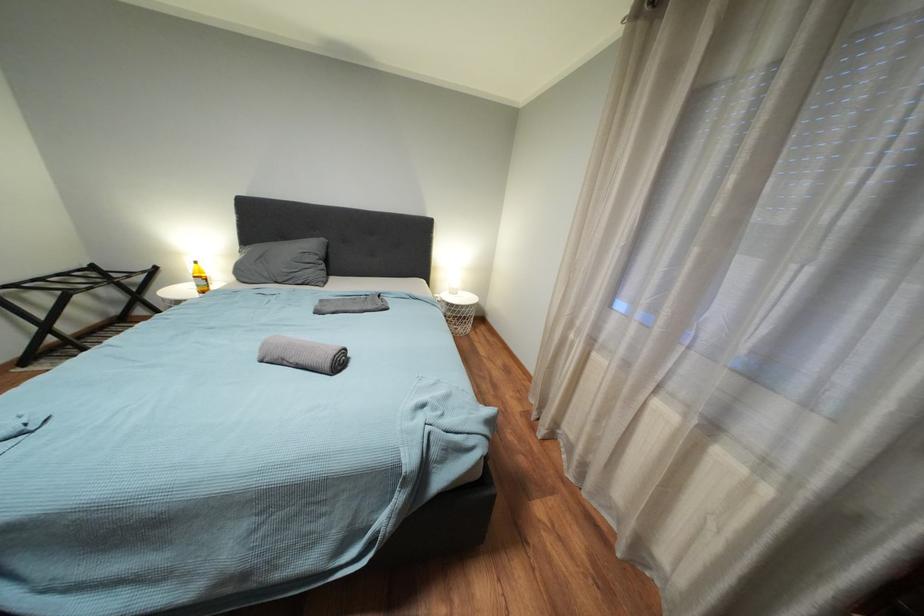
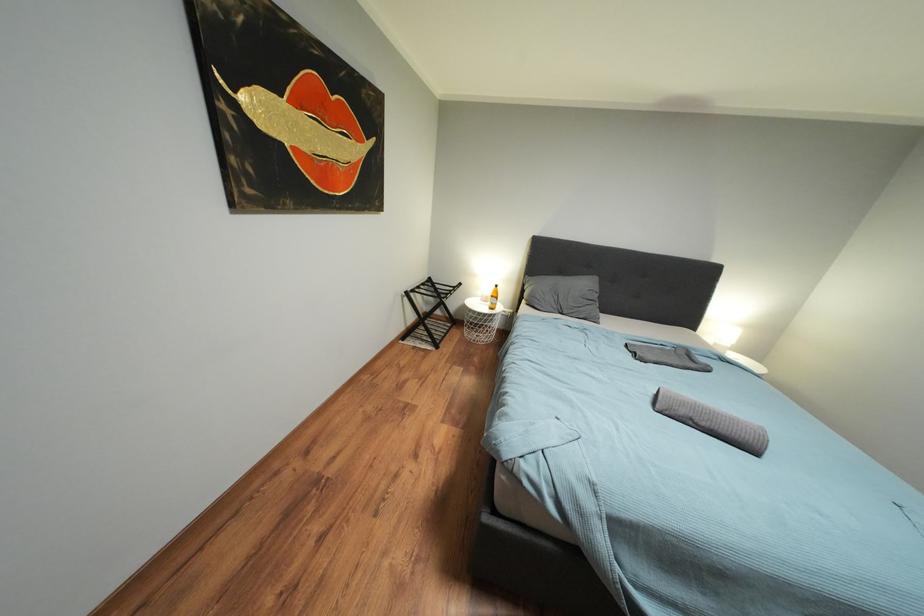
Question: Which direction would the cameraman need to move to produce the second image? Reply with the corresponding letter.

Choices:
 (A) Left
 (B) Right
 (C) Forward
 (D) Backward

Answer: (A)